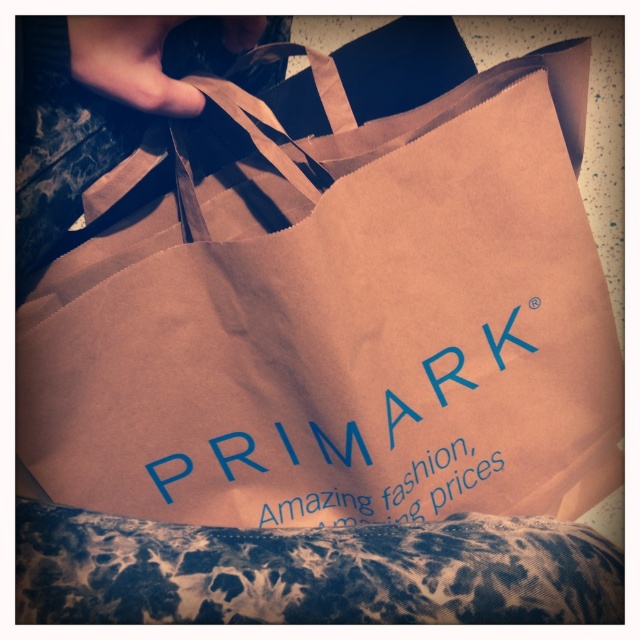
Question: Considering the relative positions of brown paper bag at center and leopard print fabric pillow at lower center in the image provided, where is brown paper bag at center located with respect to leopard print fabric pillow at lower center?

Choices:
 (A) below
 (B) above

Answer: (B)

Question: Which of the following is the farthest from the observer?

Choices:
 (A) (413, 417)
 (B) (154, 300)
 (C) (369, 570)

Answer: (A)

Question: Which is farther from the blue paper bag at center?

Choices:
 (A) leopard print fabric pillow at lower center
 (B) brown paper bag at center

Answer: (A)

Question: Is leopard print fabric pillow at lower center smaller than blue paper bag at center?

Choices:
 (A) yes
 (B) no

Answer: (B)

Question: Which object is positioned closest to the brown paper bag at center?

Choices:
 (A) leopard print fabric pillow at lower center
 (B) blue paper bag at center

Answer: (B)

Question: Is leopard print fabric pillow at lower center wider than blue paper bag at center?

Choices:
 (A) no
 (B) yes

Answer: (B)